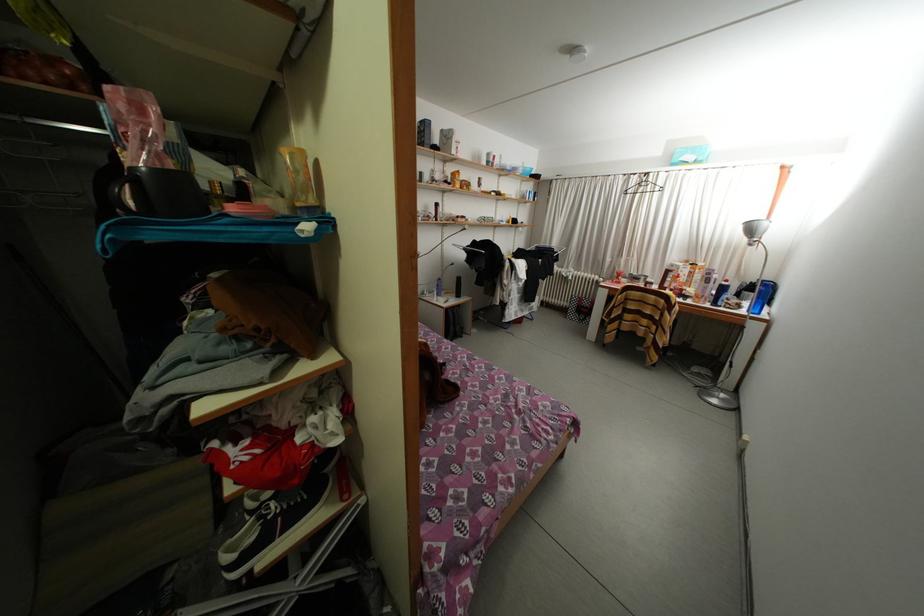
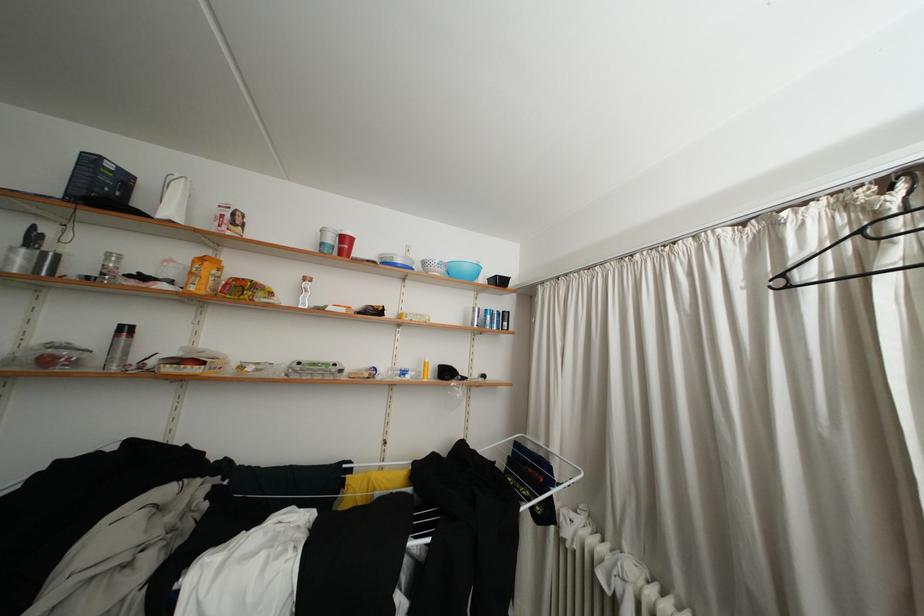
In the second image, find the point that corresponds to point 495,167 in the first image.

(330, 249)